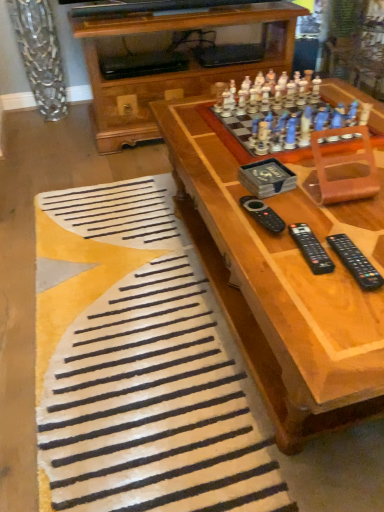
Question: Can you see black plastic remote at lower right, the 3th remote viewed from the left, touching black plastic remote at lower right, which ranks as the second remote in left-to-right order?

Choices:
 (A) no
 (B) yes

Answer: (B)

Question: Considering the relative sizes of black plastic remote at lower right, which appears as the first remote when viewed from the right, and black plastic remote at lower right, acting as the 2th remote starting from the right, in the image provided, is black plastic remote at lower right, which appears as the first remote when viewed from the right, wider than black plastic remote at lower right, acting as the 2th remote starting from the right,?

Choices:
 (A) yes
 (B) no

Answer: (A)

Question: Can you confirm if black plastic remote at lower right, which appears as the first remote when viewed from the right, is smaller than black plastic remote at lower right, which ranks as the second remote in left-to-right order?

Choices:
 (A) no
 (B) yes

Answer: (A)

Question: From the image's perspective, is black plastic remote at lower right, which appears as the first remote when viewed from the right, located above black plastic remote at lower right, acting as the 2th remote starting from the right?

Choices:
 (A) yes
 (B) no

Answer: (B)

Question: Is black plastic remote at lower right, the 3th remote viewed from the left, facing away from black plastic remote at lower right, which ranks as the second remote in left-to-right order?

Choices:
 (A) no
 (B) yes

Answer: (A)

Question: Does black plastic remote at lower right, the 3th remote viewed from the left, have a lesser height compared to black plastic remote at lower right, acting as the 2th remote starting from the right?

Choices:
 (A) yes
 (B) no

Answer: (B)

Question: Would you consider white soft rug at lower center to be distant from black plastic remote at lower right, which appears as the first remote when viewed from the right?

Choices:
 (A) no
 (B) yes

Answer: (A)

Question: Considering the relative positions of white soft rug at lower center and black plastic remote at lower right, the 3th remote viewed from the left, in the image provided, is white soft rug at lower center to the right of black plastic remote at lower right, the 3th remote viewed from the left, from the viewer's perspective?

Choices:
 (A) no
 (B) yes

Answer: (A)

Question: Does white soft rug at lower center lie in front of black plastic remote at lower right, which appears as the first remote when viewed from the right?

Choices:
 (A) no
 (B) yes

Answer: (B)

Question: Is black plastic remote at lower right, the 3th remote viewed from the left, a part of white soft rug at lower center?

Choices:
 (A) no
 (B) yes

Answer: (A)

Question: Is white soft rug at lower center taller than black plastic remote at lower right, which appears as the first remote when viewed from the right?

Choices:
 (A) yes
 (B) no

Answer: (A)

Question: Can you confirm if white soft rug at lower center is smaller than black plastic remote at lower right, the 3th remote viewed from the left?

Choices:
 (A) no
 (B) yes

Answer: (A)

Question: From the image's perspective, is white soft rug at lower center beneath wooden chess set at upper right?

Choices:
 (A) no
 (B) yes

Answer: (B)